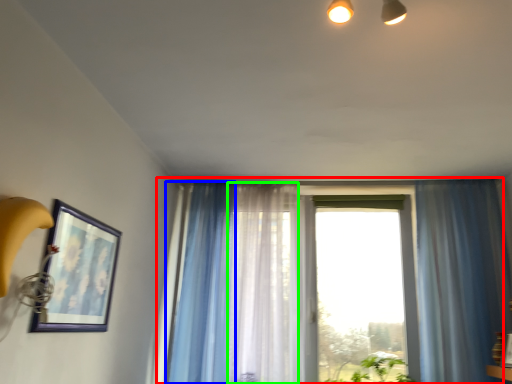
Question: Based on their relative distances, which object is farther from window (highlighted by a red box)? Choose from curtain (highlighted by a blue box) and curtain (highlighted by a green box).

Choices:
 (A) curtain
 (B) curtain

Answer: (A)